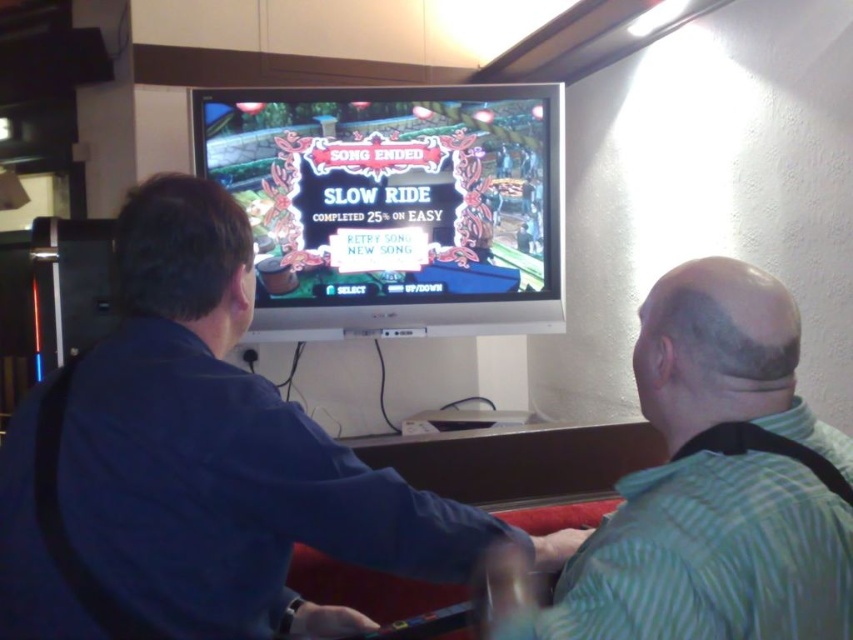
You are a photographer who wants to take a picture of the blue shirt at center and the matte plastic video game at center. Which object should you zoom in on to capture both in the frame without moving the camera?

The blue shirt at center has a larger size compared to the matte plastic video game at center, so you should zoom in on the blue shirt at center to ensure both objects fit in the frame.

You are a delivery robot that needs to place a small package at point (440, 515) in the room. The robot can extend its arm up to 40 inches. Can the robot reach that point without moving its base?

The distance between point (440, 515) and the camera is 38.54 inches. Since the robot can extend its arm up to 40 inches, it can reach the point without moving its base.